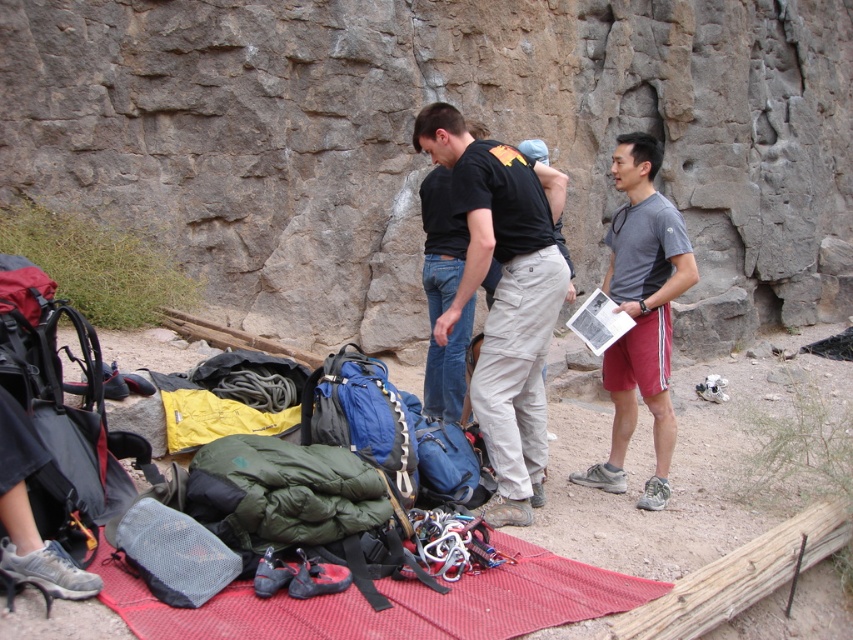
You are planning to set up a safety zone for rock climbers. The gray rough rock face at center is at coordinates point 0.250, 0.501. Where should you position the safety zone relative to this rock face to ensure climbers are protected from falling debris?

The gray rough rock face at center is located at point (426, 160). To ensure safety from falling debris, the safety zone should be positioned away from the base of the rock face, possibly behind or to the sides, but not directly under it.